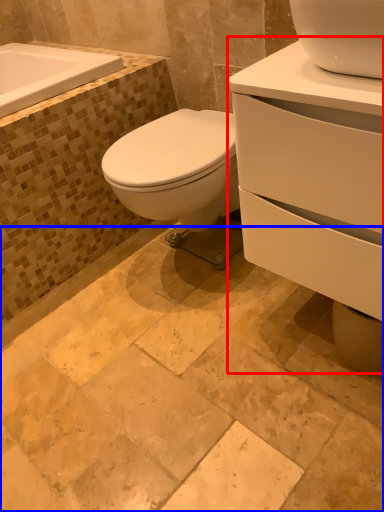
Question: Among these objects, which one is nearest to the camera, porcelain (highlighted by a red box) or ceramic tile (highlighted by a blue box)?

Choices:
 (A) porcelain
 (B) ceramic tile

Answer: (B)